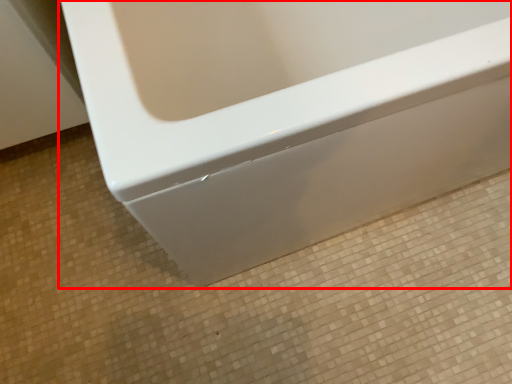
Question: From the image's perspective, what is the correct spatial positioning of bathtub (annotated by the red box) in reference to ceramic tile?

Choices:
 (A) above
 (B) below

Answer: (A)